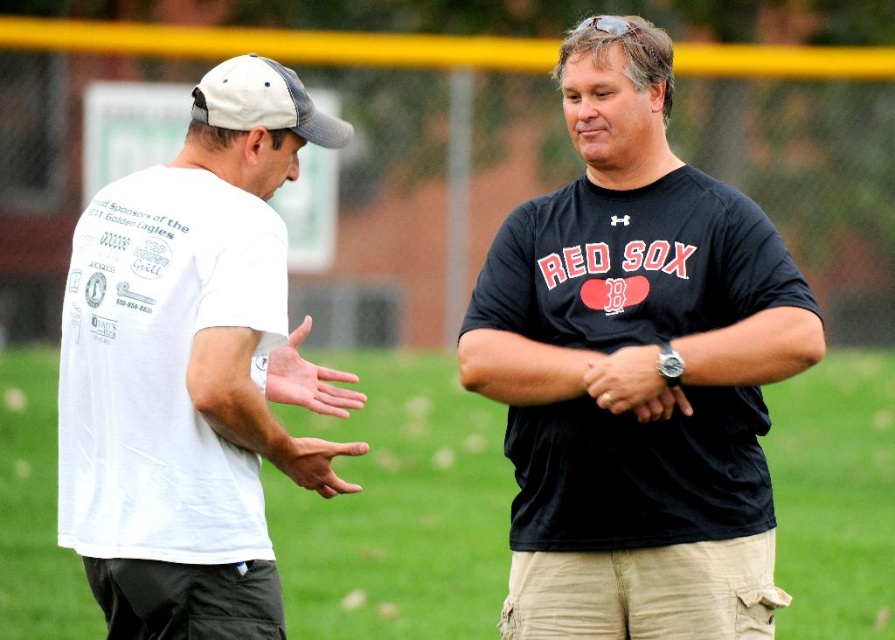
You are a photographer trying to capture a closeup of the white mesh baseball cap at upper left and the matte white hand at center in the image. If the cap is wider than the hand, will it occupy more space in the photo?

The white mesh baseball cap at upper left might be wider than matte white hand at center, so it could occupy more space in the photo if it is indeed wider.

You are a photographer trying to capture a closeup shot of the white mesh baseball cap at upper left and the matte white hand at center. Which object should you zoom in on more to ensure both are in focus?

The white mesh baseball cap at upper left has a smaller size compared to the matte white hand at center, so you should zoom in more on the matte white hand at center to ensure both are in focus.